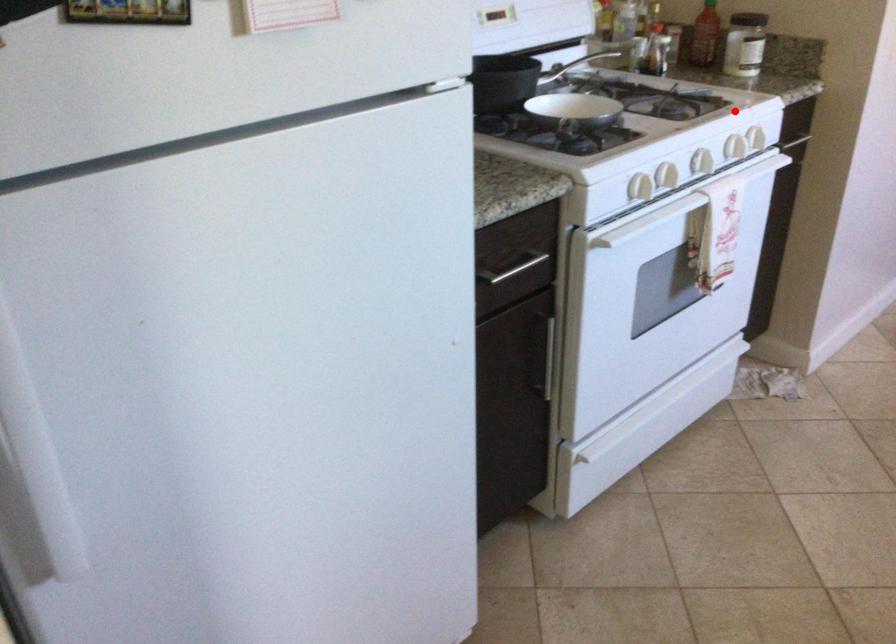
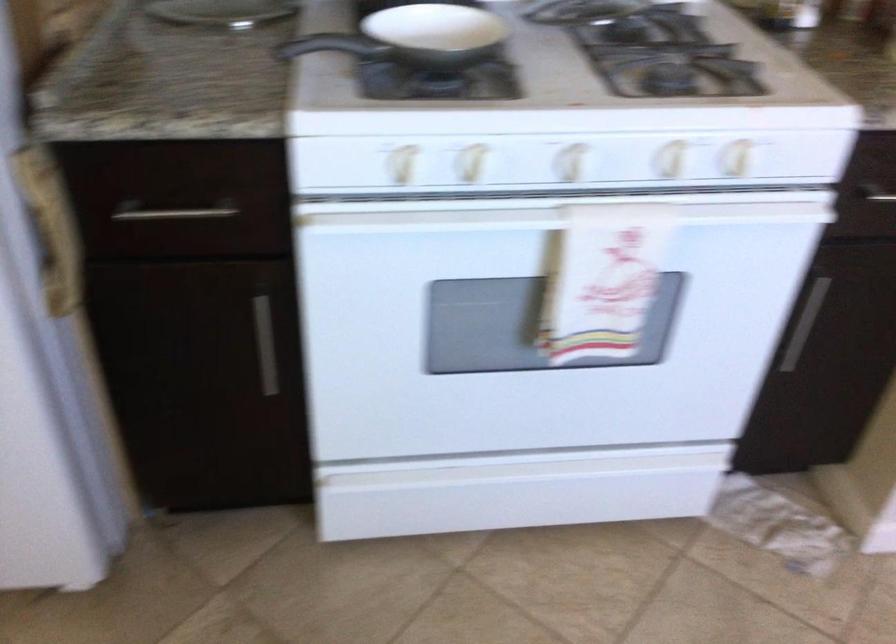
Question: A red point is marked in image1. In image2, is the corresponding 3D point closer to the camera or farther? Reply with the corresponding letter.

Choices:
 (A) The corresponding 3D point is closer.
 (B) The corresponding 3D point is farther.

Answer: (A)